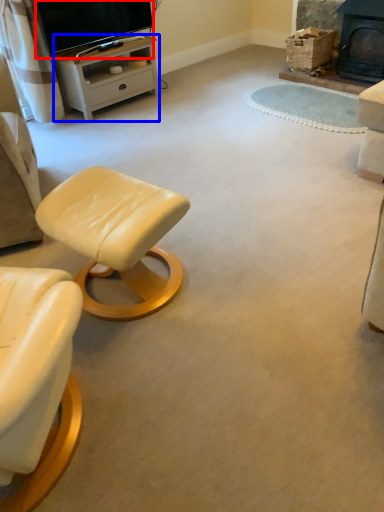
Question: Which point is closer to the camera, television (highlighted by a red box) or desk (highlighted by a blue box)?

Choices:
 (A) television
 (B) desk

Answer: (A)